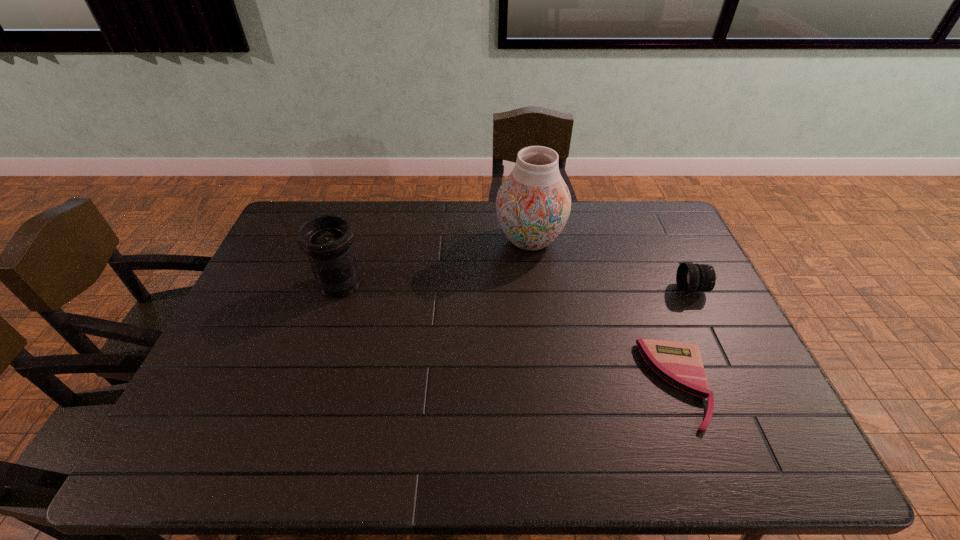
Locate an element on the screen. free spot at the near edge of the desktop is located at coordinates (459, 431).

In the image, there is a desktop. Where is `vacant space at the left edge`? vacant space at the left edge is located at coordinates (243, 347).

You are a GUI agent. You are given a task and a screenshot of the screen. Output one action in this format:
    pyautogui.click(x=<x>, y=<y>)
    Task: Click on the free region at the right edge of the desktop
    Image resolution: width=960 pixels, height=540 pixels.
    Given the screenshot: What is the action you would take?
    pyautogui.click(x=752, y=426)

This screenshot has height=540, width=960. Identify the location of free spot at the far left corner of the desktop. (291, 215).

The width and height of the screenshot is (960, 540). Find the location of `blank space at the near left corner`. blank space at the near left corner is located at coordinates (215, 438).

Locate an element on the screen. This screenshot has width=960, height=540. free spot between the second tallest object and the vase is located at coordinates (435, 262).

Locate an element on the screen. The image size is (960, 540). free space between the vase and the right telephoto lens is located at coordinates (612, 265).

The height and width of the screenshot is (540, 960). Identify the location of blank region between the nearest object and the farthest object. (604, 312).

Where is `free space between the farthest object and the taller telephoto lens`? This screenshot has height=540, width=960. free space between the farthest object and the taller telephoto lens is located at coordinates (435, 262).

The image size is (960, 540). I want to click on free point between the right telephoto lens and the farthest object, so click(612, 265).